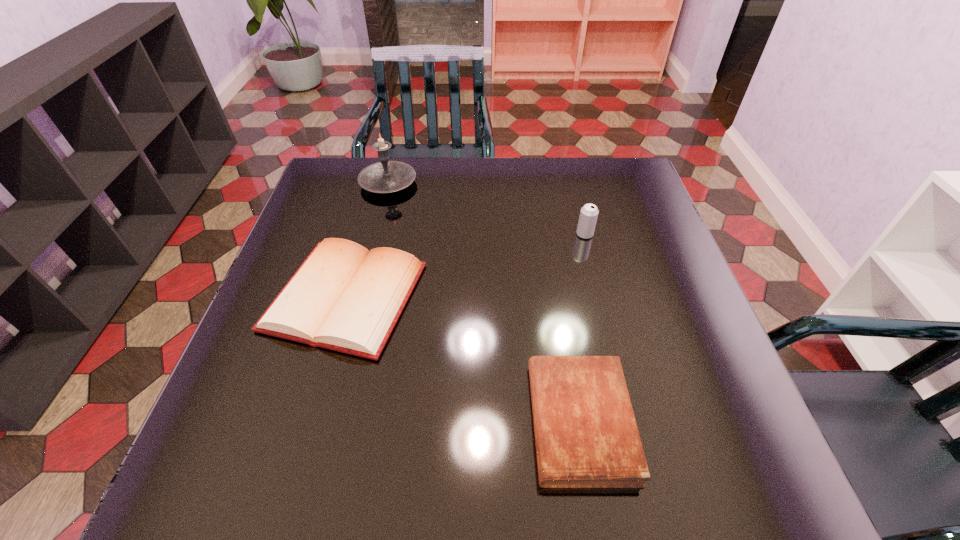
I want to click on candle, so click(386, 176).

Where is `the farthest object`? Image resolution: width=960 pixels, height=540 pixels. the farthest object is located at coordinates (386, 176).

Where is `beer can`? Image resolution: width=960 pixels, height=540 pixels. beer can is located at coordinates (588, 216).

Image resolution: width=960 pixels, height=540 pixels. I want to click on the second farthest object, so click(588, 216).

Locate an element on the screen. The image size is (960, 540). the second nearest object is located at coordinates tap(344, 298).

Identify the location of the left Bible. The height and width of the screenshot is (540, 960). (344, 298).

Locate an element on the screen. the shorter Bible is located at coordinates (586, 436).

Identify the location of the nearer Bible. (586, 436).

At what (x,y) coordinates should I click in order to perform the action: click on vacant region located 0.180m on the front of the farthest object. Please return your answer as a coordinate pair (x, y). This screenshot has width=960, height=540. Looking at the image, I should click on (373, 241).

The image size is (960, 540). I want to click on blank space located on the front of the beer can, so click(614, 352).